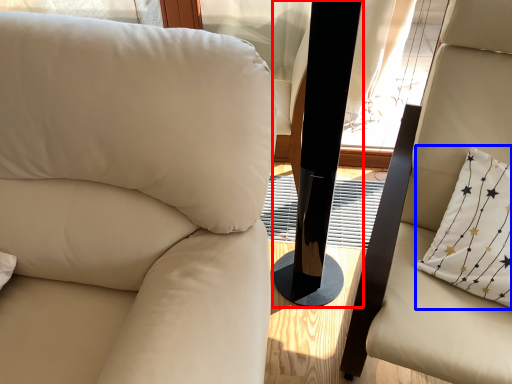
Question: Which object is further to the camera taking this photo, pillar (highlighted by a red box) or pillow (highlighted by a blue box)?

Choices:
 (A) pillar
 (B) pillow

Answer: (B)